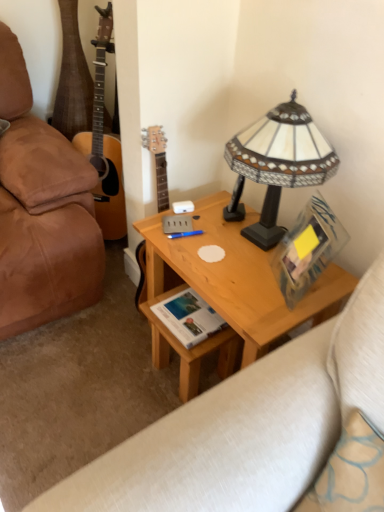
Where is `free space above light wood desk at center (from a real-world perspective)`? Image resolution: width=384 pixels, height=512 pixels. free space above light wood desk at center (from a real-world perspective) is located at coordinates (231, 244).